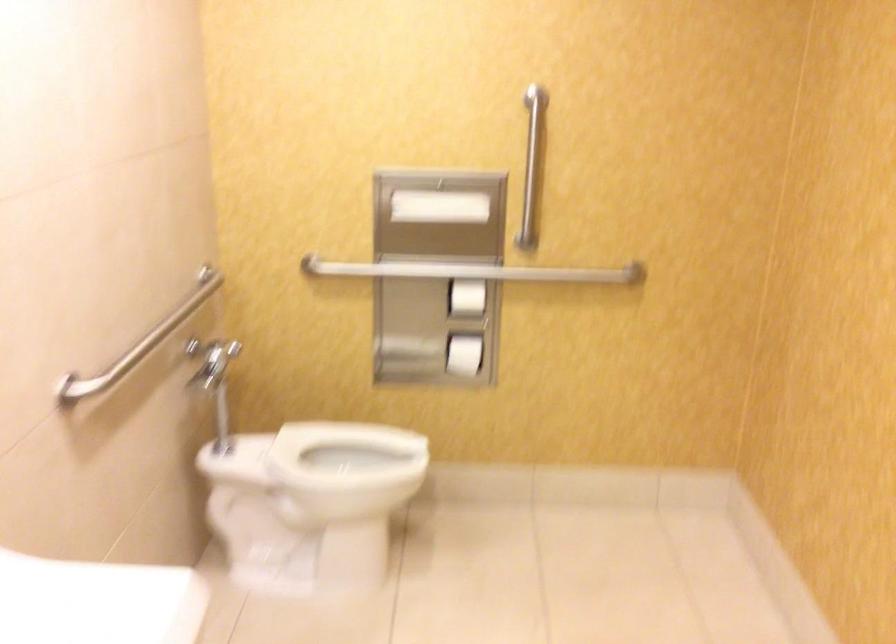
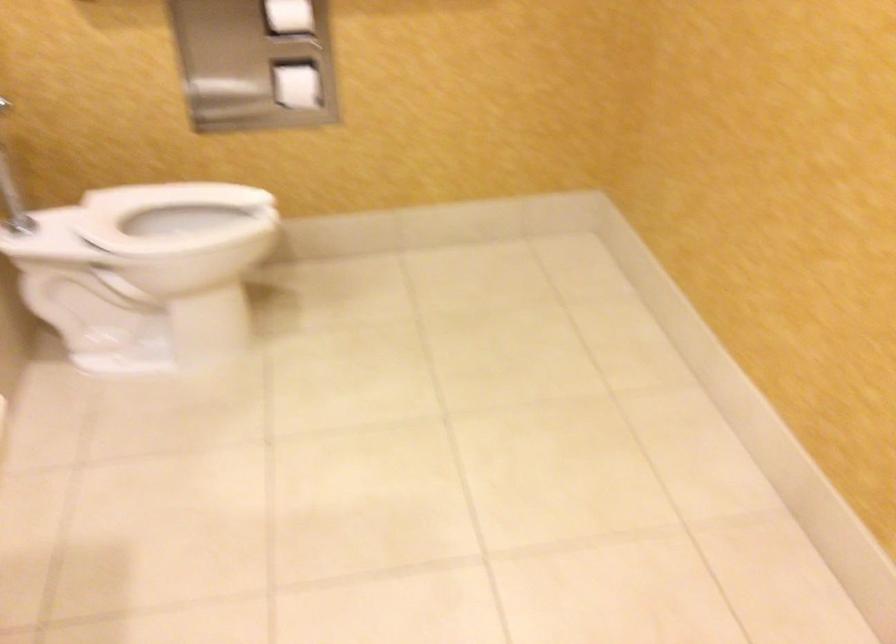
Where in the second image is the point corresponding to pixel 341 451 from the first image?

(174, 216)